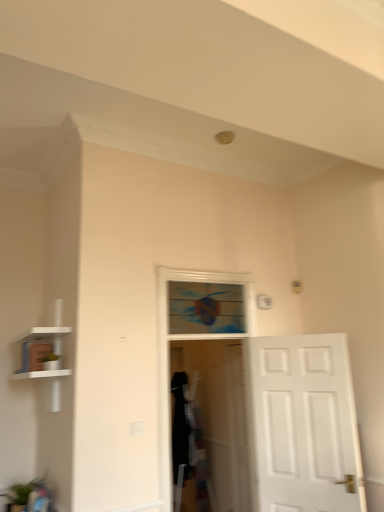
Question: Is transparent plastic screen door at center outside white matte bookshelf at left?

Choices:
 (A) no
 (B) yes

Answer: (B)

Question: Is transparent plastic screen door at center next to white matte bookshelf at left and touching it?

Choices:
 (A) no
 (B) yes

Answer: (A)

Question: Is white matte bookshelf at left at the back of transparent plastic screen door at center?

Choices:
 (A) no
 (B) yes

Answer: (A)

Question: Considering the relative sizes of transparent plastic screen door at center and white matte bookshelf at left in the image provided, is transparent plastic screen door at center wider than white matte bookshelf at left?

Choices:
 (A) no
 (B) yes

Answer: (A)

Question: Does transparent plastic screen door at center turn towards white matte bookshelf at left?

Choices:
 (A) no
 (B) yes

Answer: (A)

Question: Can you confirm if transparent plastic screen door at center is positioned to the right of white matte bookshelf at left?

Choices:
 (A) yes
 (B) no

Answer: (A)

Question: Would you consider transparent plastic screen door at center to be distant from wooden stained window at center?

Choices:
 (A) yes
 (B) no

Answer: (A)

Question: From a real-world perspective, does transparent plastic screen door at center stand above wooden stained window at center?

Choices:
 (A) no
 (B) yes

Answer: (A)

Question: From a real-world perspective, is transparent plastic screen door at center beneath wooden stained window at center?

Choices:
 (A) yes
 (B) no

Answer: (A)

Question: Could wooden stained window at center be considered to be inside transparent plastic screen door at center?

Choices:
 (A) no
 (B) yes

Answer: (A)

Question: Does transparent plastic screen door at center appear on the right side of wooden stained window at center?

Choices:
 (A) yes
 (B) no

Answer: (A)

Question: Can you confirm if transparent plastic screen door at center is positioned to the left of wooden stained window at center?

Choices:
 (A) no
 (B) yes

Answer: (A)

Question: Is wooden stained window at center taller than white matte bookshelf at left?

Choices:
 (A) no
 (B) yes

Answer: (A)